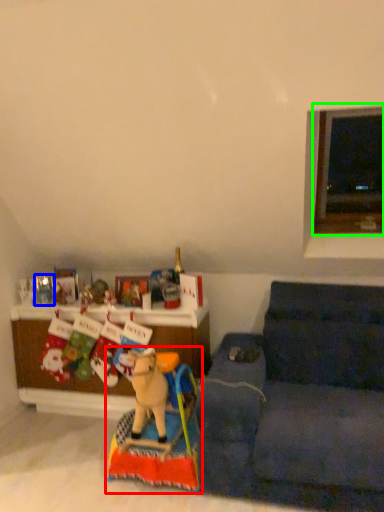
Question: Which is nearer to the toy (highlighted by a red box)? toy (highlighted by a blue box) or window (highlighted by a green box).

Choices:
 (A) toy
 (B) window

Answer: (A)